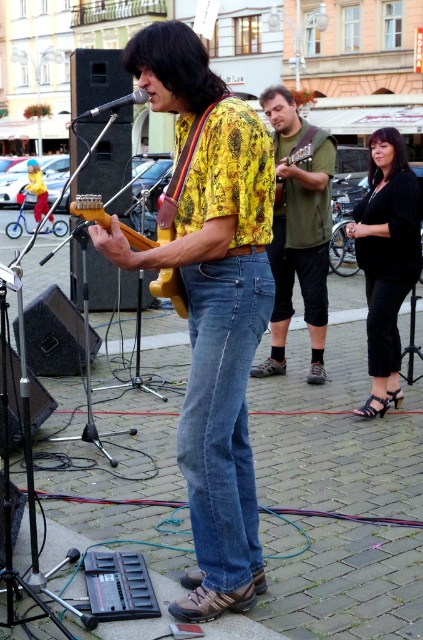
What are the coordinates of the green fabric vest at center?

The green fabric vest at center is located at point (x=299, y=230).

You are a street performer who just finished your set. You need to carry both the wooden electric guitar at center and the wooden acoustic guitar at center to your car. Which guitar should you pick up first if you want to carry the larger one first?

The wooden electric guitar at center is larger in size than the wooden acoustic guitar at center, so you should pick up the wooden electric guitar at center first.